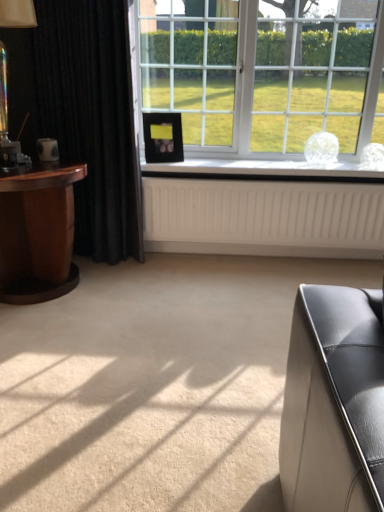
The image size is (384, 512). What do you see at coordinates (262, 217) in the screenshot? I see `white textured radiator at center` at bounding box center [262, 217].

Image resolution: width=384 pixels, height=512 pixels. What do you see at coordinates (263, 170) in the screenshot? I see `clear glass vase at center` at bounding box center [263, 170].

The height and width of the screenshot is (512, 384). Identify the location of translucent glass table lamp at left. (7, 121).

At what (x,y) coordinates should I click in order to perform the action: click on black matte picture frame at center. Please return your answer as a coordinate pair (x, y). Image resolution: width=384 pixels, height=512 pixels. Looking at the image, I should click on (163, 137).

The height and width of the screenshot is (512, 384). I want to click on black velvet curtain at left, so click(x=82, y=114).

Locate an element on the screen. Image resolution: width=384 pixels, height=512 pixels. white textured radiator at center is located at coordinates (262, 217).

Is clear glass window at center smaller than translucent glass table lamp at left?

No.

Considering the positions of objects clear glass window at center and translucent glass table lamp at left in the image provided, who is more to the right, clear glass window at center or translucent glass table lamp at left?

From the viewer's perspective, clear glass window at center appears more on the right side.

From the image's perspective, between clear glass window at center and translucent glass table lamp at left, which one is located above?

clear glass window at center appears higher in the image.

Considering the sizes of objects translucent glass table lamp at left and black velvet curtain at left in the image provided, who is taller, translucent glass table lamp at left or black velvet curtain at left?

black velvet curtain at left is taller.

Identify the location of curtain below the translucent glass table lamp at left (from a real-world perspective). (82, 114).

Is translucent glass table lamp at left beside black velvet curtain at left?

No, translucent glass table lamp at left is not touching black velvet curtain at left.

Which is correct: clear glass window at center is inside clear glass vase at center, or outside of it?

clear glass window at center cannot be found inside clear glass vase at center.

In terms of height, does clear glass window at center look taller or shorter compared to clear glass vase at center?

Clearly, clear glass window at center is taller compared to clear glass vase at center.

This screenshot has height=512, width=384. Identify the location of window sill that is on the left side of clear glass window at center. (263, 170).

Does clear glass window at center lie behind clear glass vase at center?

No, it is in front of clear glass vase at center.

Considering the positions of objects black velvet curtain at left and translucent glass table lamp at left in the image provided, who is behind, black velvet curtain at left or translucent glass table lamp at left?

black velvet curtain at left is further away from the camera.

Can you tell me how much black velvet curtain at left and translucent glass table lamp at left differ in facing direction?

The angular difference between black velvet curtain at left and translucent glass table lamp at left is 89.1 degrees.

Can you confirm if black velvet curtain at left is taller than translucent glass table lamp at left?

Yes, black velvet curtain at left is taller than translucent glass table lamp at left.

Is black velvet curtain at left inside the boundaries of translucent glass table lamp at left, or outside?

black velvet curtain at left is not inside translucent glass table lamp at left, it's outside.

Which is in front, mahogany wood side table at left or black velvet curtain at left?

Positioned in front is mahogany wood side table at left.

Does point (64, 168) lie behind point (65, 123)?

No, (64, 168) is in front of (65, 123).

Does mahogany wood side table at left appear on the left side of black velvet curtain at left?

Correct, you'll find mahogany wood side table at left to the left of black velvet curtain at left.

Are mahogany wood side table at left and clear glass vase at center far apart?

No, mahogany wood side table at left is not far away from clear glass vase at center.

Based on the photo, from the image's perspective, between mahogany wood side table at left and clear glass vase at center, who is located below?

mahogany wood side table at left, from the image's perspective.

Is mahogany wood side table at left positioned in front of clear glass vase at center?

→ Yes, mahogany wood side table at left is closer to the camera.

From a real-world perspective, who is located higher, black velvet curtain at left or mahogany wood side table at left?

black velvet curtain at left.

How many degrees apart are the facing directions of black velvet curtain at left and mahogany wood side table at left?

black velvet curtain at left and mahogany wood side table at left are facing 89.8 degrees away from each other.

Which is in front, black velvet curtain at left or mahogany wood side table at left?

mahogany wood side table at left is closer to the camera.

Would you say black velvet curtain at left is outside mahogany wood side table at left?

Yes, black velvet curtain at left is not within mahogany wood side table at left.

The width and height of the screenshot is (384, 512). I want to click on table lamp above the clear glass window at center (from a real-world perspective), so click(x=7, y=121).

The height and width of the screenshot is (512, 384). In order to click on table lamp above the black velvet curtain at left (from the image's perspective) in this screenshot , I will do `click(7, 121)`.

Looking at the image, which one is located closer to black matte picture frame at center, translucent glass table lamp at left or mahogany wood side table at left?

mahogany wood side table at left is positioned closer to the anchor black matte picture frame at center.

Looking at the image, which one is located further to mahogany wood side table at left, translucent glass table lamp at left or black matte picture frame at center?

Among the two, black matte picture frame at center is located further to mahogany wood side table at left.

From the image, which object appears to be farther from clear glass vase at center, white textured radiator at center or black velvet curtain at left?

black velvet curtain at left lies further to clear glass vase at center than the other object.

Estimate the real-world distances between objects in this image. Which object is closer to clear glass window at center, black velvet curtain at left or translucent glass table lamp at left?

Among the two, black velvet curtain at left is located nearer to clear glass window at center.

Considering their positions, is clear glass window at center positioned further to white textured radiator at center than black velvet curtain at left?

black velvet curtain at left.

Based on their spatial positions, is clear glass vase at center or black velvet curtain at left closer to mahogany wood side table at left?

Among the two, black velvet curtain at left is located nearer to mahogany wood side table at left.

Which object lies further to the anchor point translucent glass table lamp at left, white textured radiator at center or clear glass window at center?

white textured radiator at center is positioned further to the anchor translucent glass table lamp at left.

Which object lies further to the anchor point translucent glass table lamp at left, black matte picture frame at center or clear glass window at center?

clear glass window at center.

The width and height of the screenshot is (384, 512). In order to click on picture frame between mahogany wood side table at left and clear glass window at center in this screenshot , I will do [163, 137].

At what (x,y) coordinates should I click in order to perform the action: click on picture frame situated between mahogany wood side table at left and white textured radiator at center from left to right. Please return your answer as a coordinate pair (x, y). This screenshot has height=512, width=384. Looking at the image, I should click on (163, 137).

Where is `picture frame located between mahogany wood side table at left and clear glass vase at center in the left-right direction`? The image size is (384, 512). picture frame located between mahogany wood side table at left and clear glass vase at center in the left-right direction is located at coordinates (163, 137).

What are the coordinates of `curtain located between translucent glass table lamp at left and white textured radiator at center in the left-right direction` in the screenshot? It's located at (82, 114).